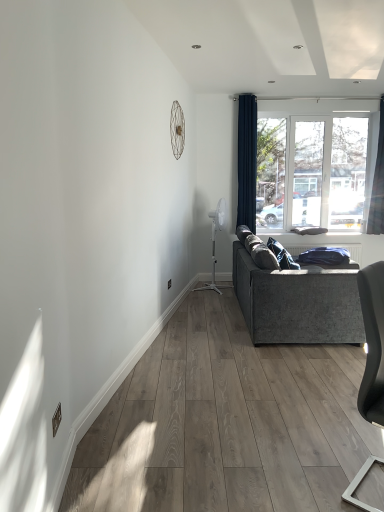
Image resolution: width=384 pixels, height=512 pixels. Describe the element at coordinates (321, 163) in the screenshot. I see `transparent glass window at upper right` at that location.

The width and height of the screenshot is (384, 512). What do you see at coordinates (372, 343) in the screenshot?
I see `matte gray chair at lower right` at bounding box center [372, 343].

Measure the distance between point (379,349) and camera.

1.82 meters.

The width and height of the screenshot is (384, 512). I want to click on transparent glass window at upper right, so click(x=321, y=163).

From a real-world perspective, relative to dark blue fabric curtain at right, placed as the 1th curtain when sorted from right to left, is navy blue fabric curtain at upper right, marked as the second curtain in a right-to-left arrangement, vertically above or below?

navy blue fabric curtain at upper right, marked as the second curtain in a right-to-left arrangement, is situated lower than dark blue fabric curtain at right, placed as the 1th curtain when sorted from right to left, in the real world.

Considering the sizes of objects navy blue fabric curtain at upper right, marked as the second curtain in a right-to-left arrangement, and dark blue fabric curtain at right, placed as the 1th curtain when sorted from right to left, in the image provided, who is smaller, navy blue fabric curtain at upper right, marked as the second curtain in a right-to-left arrangement, or dark blue fabric curtain at right, placed as the 1th curtain when sorted from right to left,?

dark blue fabric curtain at right, placed as the 1th curtain when sorted from right to left.

Does navy blue fabric curtain at upper right, marked as the second curtain in a right-to-left arrangement, have a greater height compared to dark blue fabric curtain at right, placed as the 1th curtain when sorted from right to left?

Indeed, navy blue fabric curtain at upper right, marked as the second curtain in a right-to-left arrangement, has a greater height compared to dark blue fabric curtain at right, placed as the 1th curtain when sorted from right to left.

Which point is more forward, (x=329, y=218) or (x=372, y=322)?

Positioned in front is point (x=372, y=322).

Is transparent glass window at upper right aimed at matte gray chair at lower right?

Yes, transparent glass window at upper right faces towards matte gray chair at lower right.

Is transparent glass window at upper right outside of matte gray chair at lower right?

Absolutely, transparent glass window at upper right is external to matte gray chair at lower right.

Which is more to the right, transparent glass window at upper right or matte gray chair at lower right?

transparent glass window at upper right is more to the right.

Is matte gray chair at lower right positioned beyond the bounds of dark blue fabric curtain at right, placed as the 1th curtain when sorted from right to left?

matte gray chair at lower right lies outside dark blue fabric curtain at right, placed as the 1th curtain when sorted from right to left,'s area.

Considering the points (375, 336) and (382, 140), which point is behind, point (375, 336) or point (382, 140)?

The point (382, 140) is more distant.

From a real-world perspective, between matte gray chair at lower right and dark blue fabric curtain at right, placed as the 2th curtain when sorted from left to right, who is vertically higher?

From a 3D spatial view, dark blue fabric curtain at right, placed as the 2th curtain when sorted from left to right, is above.

Considering the sizes of objects transparent glass window at upper right and navy blue fabric curtain at upper right, which is the 1th curtain from left to right, in the image provided, who is bigger, transparent glass window at upper right or navy blue fabric curtain at upper right, which is the 1th curtain from left to right,?

transparent glass window at upper right.

Is navy blue fabric curtain at upper right, marked as the second curtain in a right-to-left arrangement, at the back of transparent glass window at upper right?

transparent glass window at upper right does not have its back to navy blue fabric curtain at upper right, marked as the second curtain in a right-to-left arrangement.

Does transparent glass window at upper right have a greater width compared to navy blue fabric curtain at upper right, which is the 1th curtain from left to right?

Incorrect, the width of transparent glass window at upper right does not surpass that of navy blue fabric curtain at upper right, which is the 1th curtain from left to right.

Between point (258, 130) and point (248, 139), which one is positioned behind?

The point (258, 130) is more distant.

From a real-world perspective, is matte gray chair at lower right positioned above or below navy blue fabric curtain at upper right, which is the 1th curtain from left to right?

From a real-world perspective, matte gray chair at lower right is physically below navy blue fabric curtain at upper right, which is the 1th curtain from left to right.

In the scene shown: In terms of width, does matte gray chair at lower right look wider or thinner when compared to navy blue fabric curtain at upper right, which is the 1th curtain from left to right?

Clearly, matte gray chair at lower right has more width compared to navy blue fabric curtain at upper right, which is the 1th curtain from left to right.

Who is bigger, matte gray chair at lower right or navy blue fabric curtain at upper right, which is the 1th curtain from left to right?

With larger size is navy blue fabric curtain at upper right, which is the 1th curtain from left to right.

Does matte gray chair at lower right have a lesser height compared to navy blue fabric curtain at upper right, marked as the second curtain in a right-to-left arrangement?

Correct, matte gray chair at lower right is not as tall as navy blue fabric curtain at upper right, marked as the second curtain in a right-to-left arrangement.

Is dark blue fabric curtain at right, placed as the 2th curtain when sorted from left to right, further to camera compared to transparent glass window at upper right?

No.

Considering the positions of points (377, 151) and (335, 130), is point (377, 151) farther from camera compared to point (335, 130)?

No.

Considering the relative sizes of dark blue fabric curtain at right, placed as the 1th curtain when sorted from right to left, and transparent glass window at upper right in the image provided, is dark blue fabric curtain at right, placed as the 1th curtain when sorted from right to left, smaller than transparent glass window at upper right?

Yes.

Which object is positioned more to the left, velvet grey couch at right or dark blue fabric curtain at right, placed as the 2th curtain when sorted from left to right?

Positioned to the left is velvet grey couch at right.

Is velvet grey couch at right completely or partially outside of dark blue fabric curtain at right, placed as the 1th curtain when sorted from right to left?

velvet grey couch at right lies outside dark blue fabric curtain at right, placed as the 1th curtain when sorted from right to left,'s area.

At what (x,y) coordinates should I click in order to perform the action: click on curtain lying below the dark blue fabric curtain at right, placed as the 2th curtain when sorted from left to right (from the image's perspective). Please return your answer as a coordinate pair (x, y). Looking at the image, I should click on (247, 161).

Where is `window lying behind the matte gray chair at lower right`? window lying behind the matte gray chair at lower right is located at coordinates 321,163.

From the image, which object appears to be farther from dark blue fabric curtain at right, placed as the 1th curtain when sorted from right to left, matte gray chair at lower right or velvet grey couch at right?

matte gray chair at lower right.

Which object lies nearer to the anchor point velvet grey couch at right, matte gray chair at lower right or navy blue fabric curtain at upper right, which is the 1th curtain from left to right?

matte gray chair at lower right is positioned closer to the anchor velvet grey couch at right.

When comparing their distances from navy blue fabric curtain at upper right, marked as the second curtain in a right-to-left arrangement, does dark blue fabric curtain at right, placed as the 2th curtain when sorted from left to right, or transparent glass window at upper right seem closer?

The object closer to navy blue fabric curtain at upper right, marked as the second curtain in a right-to-left arrangement, is transparent glass window at upper right.

Looking at the image, which one is located further to matte gray chair at lower right, dark blue fabric curtain at right, placed as the 2th curtain when sorted from left to right, or navy blue fabric curtain at upper right, which is the 1th curtain from left to right?

The object further to matte gray chair at lower right is dark blue fabric curtain at right, placed as the 2th curtain when sorted from left to right.

From the image, which object appears to be nearer to navy blue fabric curtain at upper right, marked as the second curtain in a right-to-left arrangement, dark blue fabric curtain at right, placed as the 1th curtain when sorted from right to left, or matte gray chair at lower right?

dark blue fabric curtain at right, placed as the 1th curtain when sorted from right to left, is positioned closer to the anchor navy blue fabric curtain at upper right, marked as the second curtain in a right-to-left arrangement.

Looking at the image, which one is located closer to matte gray chair at lower right, navy blue fabric curtain at upper right, which is the 1th curtain from left to right, or dark blue fabric curtain at right, placed as the 2th curtain when sorted from left to right?

navy blue fabric curtain at upper right, which is the 1th curtain from left to right, lies closer to matte gray chair at lower right than the other object.

When comparing their distances from dark blue fabric curtain at right, placed as the 2th curtain when sorted from left to right, does matte gray chair at lower right or navy blue fabric curtain at upper right, which is the 1th curtain from left to right, seem further?

Among the two, matte gray chair at lower right is located further to dark blue fabric curtain at right, placed as the 2th curtain when sorted from left to right.

From the image, which object appears to be farther from velvet grey couch at right, dark blue fabric curtain at right, placed as the 2th curtain when sorted from left to right, or transparent glass window at upper right?

dark blue fabric curtain at right, placed as the 2th curtain when sorted from left to right, is further to velvet grey couch at right.

Find the location of a particular element. The image size is (384, 512). curtain between matte gray chair at lower right and navy blue fabric curtain at upper right, which is the 1th curtain from left to right, along the z-axis is located at coordinates (378, 184).

Image resolution: width=384 pixels, height=512 pixels. I want to click on window situated between navy blue fabric curtain at upper right, marked as the second curtain in a right-to-left arrangement, and dark blue fabric curtain at right, placed as the 1th curtain when sorted from right to left, from left to right, so click(321, 163).

You are a GUI agent. You are given a task and a screenshot of the screen. Output one action in this format:
    pyautogui.click(x=<x>, y=<y>)
    Task: Click on the studio couch located between matte gray chair at lower right and dark blue fabric curtain at right, placed as the 2th curtain when sorted from left to right, in the depth direction
    The height and width of the screenshot is (512, 384).
    Given the screenshot: What is the action you would take?
    pyautogui.click(x=298, y=302)

This screenshot has height=512, width=384. What are the coordinates of `studio couch between matte gray chair at lower right and navy blue fabric curtain at upper right, marked as the second curtain in a right-to-left arrangement, in the front-back direction` in the screenshot? It's located at (298, 302).